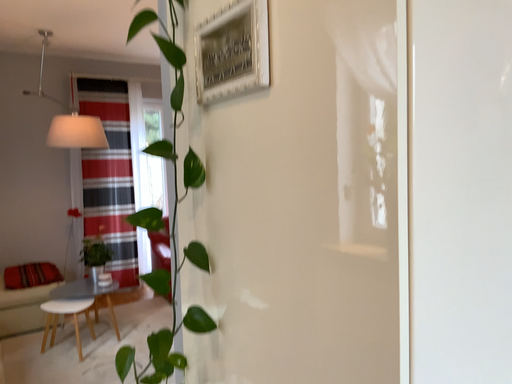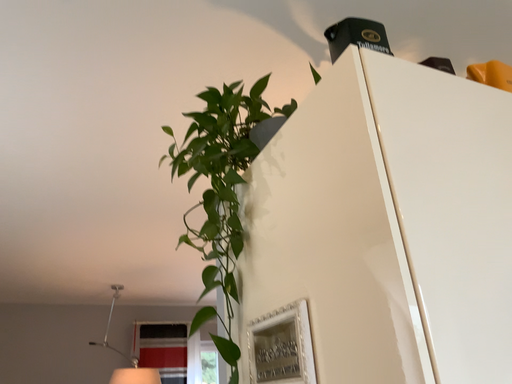
Question: How did the camera likely rotate when shooting the video?

Choices:
 (A) rotated downward
 (B) rotated upward

Answer: (B)